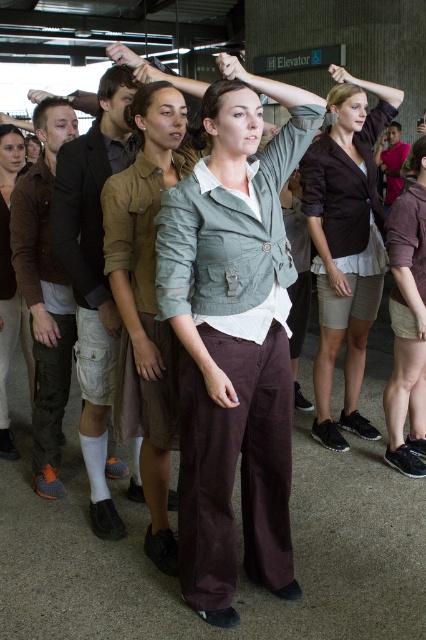
Is dark brown leather jacket at center above light brown leather jacket at center?

Indeed, dark brown leather jacket at center is positioned over light brown leather jacket at center.

Between dark brown leather jacket at center and light brown leather jacket at center, which one is positioned lower?

Positioned lower is light brown leather jacket at center.

The width and height of the screenshot is (426, 640). What do you see at coordinates (345, 241) in the screenshot?
I see `dark brown leather jacket at center` at bounding box center [345, 241].

The image size is (426, 640). What are the coordinates of `dark brown leather jacket at center` in the screenshot? It's located at (345, 241).

Does matte gray jacket at center come behind light gray cotton shirt at center?

No, matte gray jacket at center is closer to the viewer.

This screenshot has width=426, height=640. Find the location of `matte gray jacket at center`. matte gray jacket at center is located at coordinates (233, 339).

Where is `matte gray jacket at center`? Image resolution: width=426 pixels, height=640 pixels. matte gray jacket at center is located at coordinates (233, 339).

At what (x,y) coordinates should I click in order to perform the action: click on matte gray jacket at center. Please return your answer as a coordinate pair (x, y). This screenshot has height=640, width=426. Looking at the image, I should click on (233, 339).

Describe the element at coordinates (233, 339) in the screenshot. Image resolution: width=426 pixels, height=640 pixels. I see `matte gray jacket at center` at that location.

Is matte gray jacket at center bigger than dark brown leather jacket at center?

No, matte gray jacket at center is not bigger than dark brown leather jacket at center.

Where is `matte gray jacket at center`? matte gray jacket at center is located at coordinates (233, 339).